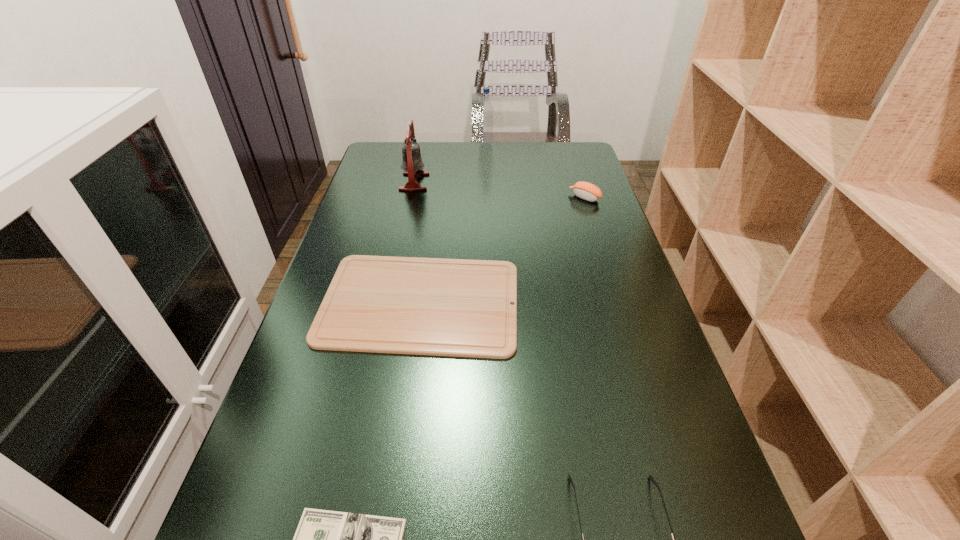
The image size is (960, 540). What are the coordinates of `bell at the left edge` in the screenshot? It's located at (412, 164).

You are a GUI agent. You are given a task and a screenshot of the screen. Output one action in this format:
    pyautogui.click(x=<x>, y=<y>)
    Task: Click on the chopping board at the left edge
    
    Given the screenshot: What is the action you would take?
    pyautogui.click(x=380, y=304)

This screenshot has width=960, height=540. I want to click on object situated at the right edge, so click(584, 190).

Identify the location of object situated at the far left corner. (412, 164).

The width and height of the screenshot is (960, 540). Find the location of `vacant space at the far edge of the desktop`. vacant space at the far edge of the desktop is located at coordinates (453, 164).

The height and width of the screenshot is (540, 960). In the image, there is a desktop. Find the location of `vacant space at the left edge`. vacant space at the left edge is located at coordinates (292, 467).

The width and height of the screenshot is (960, 540). In the image, there is a desktop. In order to click on vacant area at the right edge in this screenshot , I will do `click(609, 369)`.

The image size is (960, 540). Find the location of `free space at the far left corner`. free space at the far left corner is located at coordinates (384, 148).

Image resolution: width=960 pixels, height=540 pixels. I want to click on blank space at the far right corner of the desktop, so click(588, 151).

Find the location of a particular element. unoccupied position between the sushi and the water bottle is located at coordinates (536, 171).